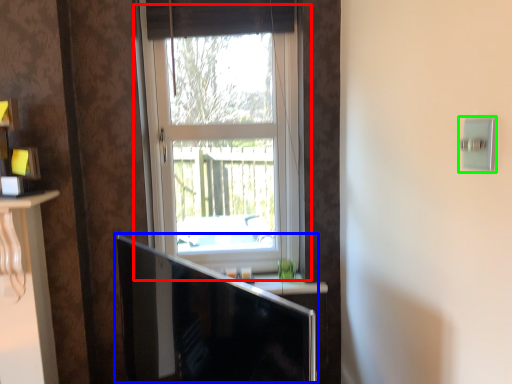
Question: Which object is the farthest from window (highlighted by a red box)? Choose among these: computer monitor (highlighted by a blue box) or light switch (highlighted by a green box).

Choices:
 (A) computer monitor
 (B) light switch

Answer: (B)